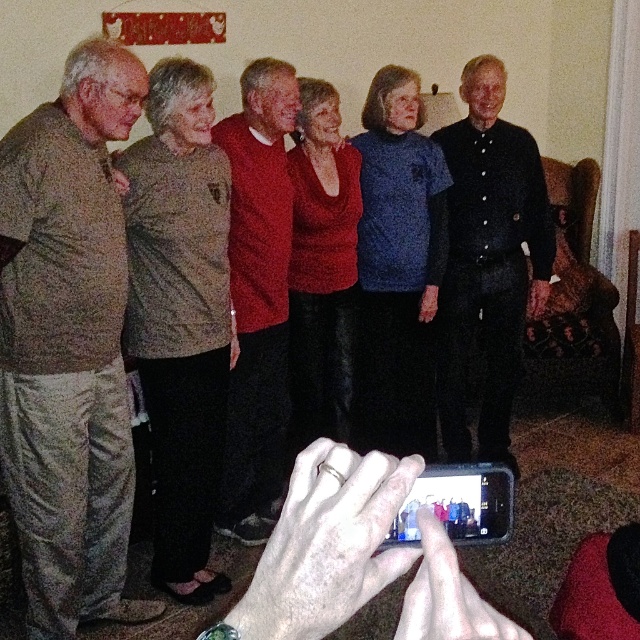
You are a photographer trying to adjust the lighting for a group photo. You notice the matte brown sweater at upper left and the black matte smartphone at lower center. Which object is positioned more to the left side of the image?

→ The matte brown sweater at upper left is positioned more to the left side of the image compared to the black matte smartphone at lower center.

You are a photographer adjusting your camera settings. You notice the matte brown sweater at upper left and the black matte smartphone at lower center in your frame. Which object is closer to your camera lens?

The matte brown sweater at upper left is closer to the camera lens because it is further to the viewer than the black matte smartphone at lower center.

You are a photographer trying to capture a group photo. You notice the matte brown sweater at upper left and the black matte smartphone at lower center in the frame. Which object takes up more space horizontally in the image?

The matte brown sweater at upper left takes up more space horizontally in the image because its width is larger than that of the black matte smartphone at lower center.